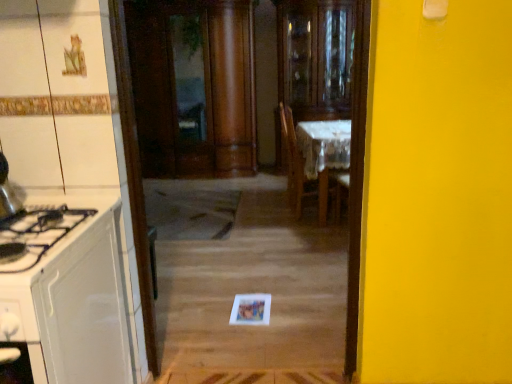
Question: Is white glossy cabinet at left inside white lace tablecloth at center?

Choices:
 (A) yes
 (B) no

Answer: (B)

Question: Is white lace tablecloth at center outside of white glossy cabinet at left?

Choices:
 (A) yes
 (B) no

Answer: (A)

Question: Can you confirm if white lace tablecloth at center is thinner than white glossy cabinet at left?

Choices:
 (A) yes
 (B) no

Answer: (A)

Question: Is white lace tablecloth at center closer to camera compared to white glossy cabinet at left?

Choices:
 (A) yes
 (B) no

Answer: (B)

Question: From the image's perspective, does white lace tablecloth at center appear higher than white glossy cabinet at left?

Choices:
 (A) no
 (B) yes

Answer: (B)

Question: From the image's perspective, is white lace tablecloth at center under white glossy cabinet at left?

Choices:
 (A) no
 (B) yes

Answer: (A)

Question: Is white glossy cabinet at left bigger than transparent glass cabinet at center?

Choices:
 (A) no
 (B) yes

Answer: (A)

Question: Does white glossy cabinet at left have a smaller size compared to transparent glass cabinet at center?

Choices:
 (A) yes
 (B) no

Answer: (A)

Question: Is white glossy cabinet at left not inside transparent glass cabinet at center?

Choices:
 (A) yes
 (B) no

Answer: (A)

Question: Is white glossy cabinet at left taller than transparent glass cabinet at center?

Choices:
 (A) yes
 (B) no

Answer: (B)

Question: Can you confirm if white glossy cabinet at left is positioned to the left of transparent glass cabinet at center?

Choices:
 (A) no
 (B) yes

Answer: (B)

Question: Does white glossy cabinet at left come behind transparent glass cabinet at center?

Choices:
 (A) no
 (B) yes

Answer: (A)

Question: Does transparent glass cabinet at center appear on the left side of white glossy cabinet at left?

Choices:
 (A) yes
 (B) no

Answer: (B)